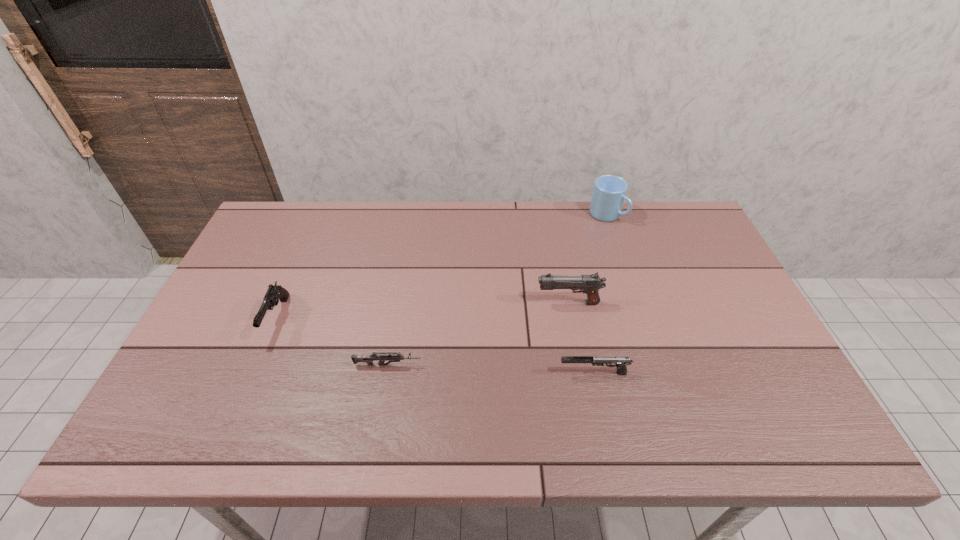
You are a GUI agent. You are given a task and a screenshot of the screen. Output one action in this format:
    pyautogui.click(x=<x>, y=<y>)
    Task: Click on the farthest object
    This screenshot has width=960, height=540.
    Given the screenshot: What is the action you would take?
    pyautogui.click(x=609, y=193)

Locate an element on the screen. Image resolution: width=960 pixels, height=540 pixels. the rightmost object is located at coordinates click(609, 193).

This screenshot has height=540, width=960. I want to click on the tallest gun, so click(589, 284).

The image size is (960, 540). What are the coordinates of `the third shortest gun` in the screenshot? It's located at (275, 292).

Image resolution: width=960 pixels, height=540 pixels. In order to click on the leftmost object in this screenshot , I will do `click(275, 292)`.

I want to click on the nearest object, so click(621, 362).

Identify the location of the second shortest object. This screenshot has width=960, height=540. (621, 362).

Locate an element on the screen. the second nearest gun is located at coordinates (368, 359).

The height and width of the screenshot is (540, 960). Find the location of `the fourth farthest object`. the fourth farthest object is located at coordinates (368, 359).

Where is `free space located on the right of the farthest object`? This screenshot has height=540, width=960. free space located on the right of the farthest object is located at coordinates (682, 215).